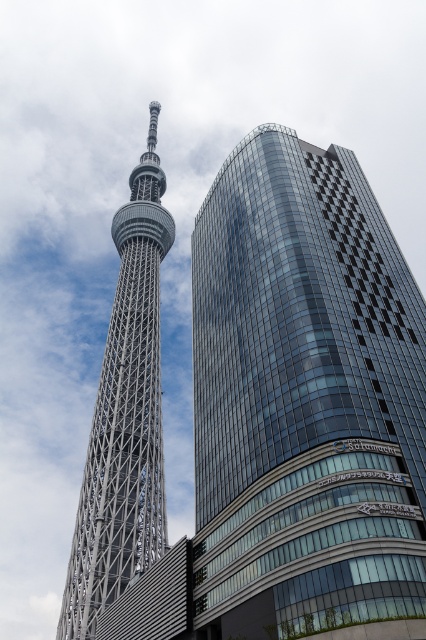
Question: Which of the following is the closest to the observer?

Choices:
 (A) silver metallic tower at left
 (B) shiny glass skyscraper at center

Answer: (B)

Question: Does shiny glass skyscraper at center appear on the left side of silver metallic tower at left?

Choices:
 (A) yes
 (B) no

Answer: (B)

Question: Is shiny glass skyscraper at center to the left of silver metallic tower at left from the viewer's perspective?

Choices:
 (A) no
 (B) yes

Answer: (A)

Question: Which of the following is the closest to the observer?

Choices:
 (A) (135, 198)
 (B) (374, 298)

Answer: (B)

Question: Is shiny glass skyscraper at center wider than silver metallic tower at left?

Choices:
 (A) no
 (B) yes

Answer: (B)